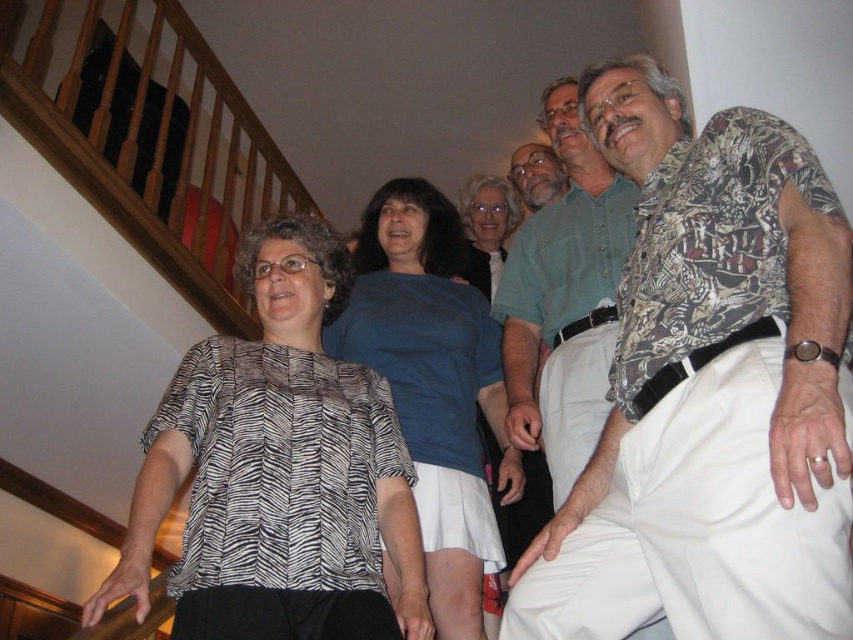
Question: Is blue cotton shirt at center below matte blue shirt at center?

Choices:
 (A) no
 (B) yes

Answer: (B)

Question: From the image, what is the correct spatial relationship of printed cotton shirt at right in relation to printed cotton shirt at upper right?

Choices:
 (A) right
 (B) left

Answer: (A)

Question: Estimate the real-world distances between objects in this image. Which object is closer to the printed cotton shirt at right?

Choices:
 (A) matte green shirt at upper center
 (B) printed cotton shirt at upper right
 (C) zebra-patterned blouse at center

Answer: (B)

Question: Estimate the real-world distances between objects in this image. Which object is farther from the matte blue shirt at center?

Choices:
 (A) printed cotton shirt at right
 (B) blue cotton shirt at center
 (C) wooden at left
 (D) zebra-patterned blouse at center

Answer: (A)

Question: Can you confirm if zebra-patterned blouse at center is smaller than matte green shirt at upper center?

Choices:
 (A) yes
 (B) no

Answer: (B)

Question: Which object is positioned farthest from the printed cotton shirt at right?

Choices:
 (A) matte green shirt at upper center
 (B) printed cotton shirt at upper right

Answer: (A)